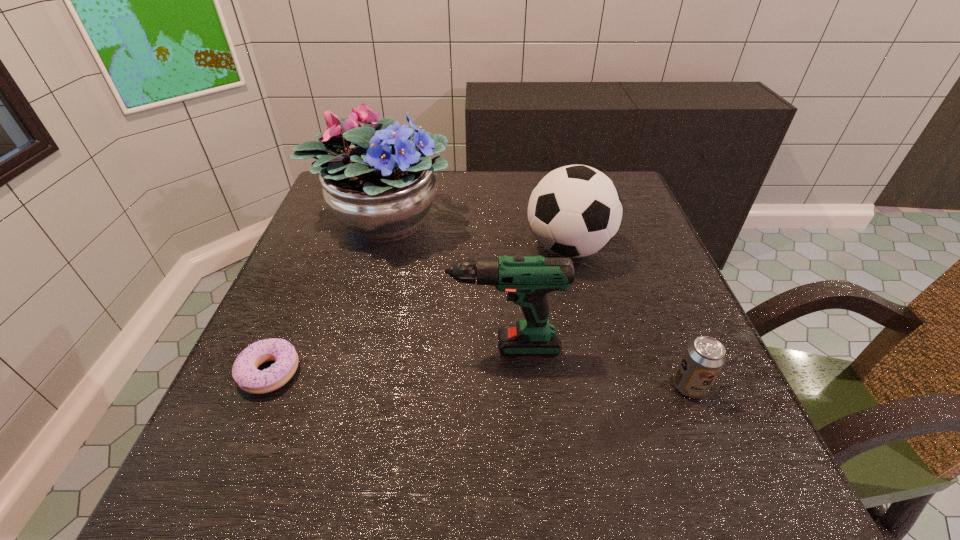
The height and width of the screenshot is (540, 960). I want to click on free area in between the rightmost object and the soccer ball, so click(629, 318).

Find the location of a particular element. vacant space that's between the soccer ball and the bouquet is located at coordinates (476, 233).

I want to click on the closest object to the fourth tallest object, so coord(527,279).

Point out which object is positioned as the nearest to the soccer ball. Please provide its 2D coordinates. Your answer should be formatted as a tuple, i.e. [(x, y)], where the tuple contains the x and y coordinates of a point satisfying the conditions above.

[(527, 279)]

Where is `vacant space that satisfies the following two spatial constraints: 1. on the handle side of the drill; 2. on the left side of the beer can`? vacant space that satisfies the following two spatial constraints: 1. on the handle side of the drill; 2. on the left side of the beer can is located at coordinates (494, 387).